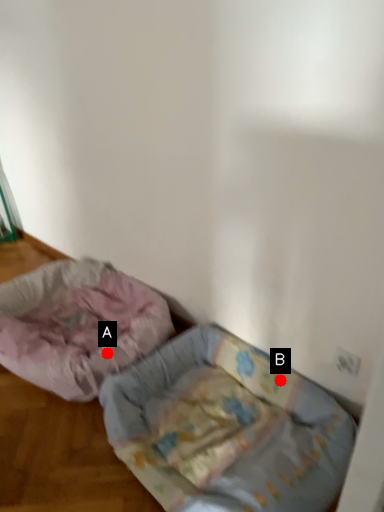
Question: Two points are circled on the image, labeled by A and B beside each circle. Which of the following is the farthest from the observer?

Choices:
 (A) A is further
 (B) B is further

Answer: (A)